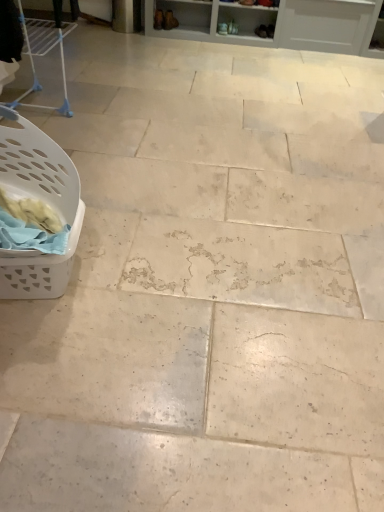
Locate an element on the screen. The height and width of the screenshot is (512, 384). vacant area that lies to the right of matte brown boot at upper center, acting as the first footwear starting from the left is located at coordinates click(x=192, y=28).